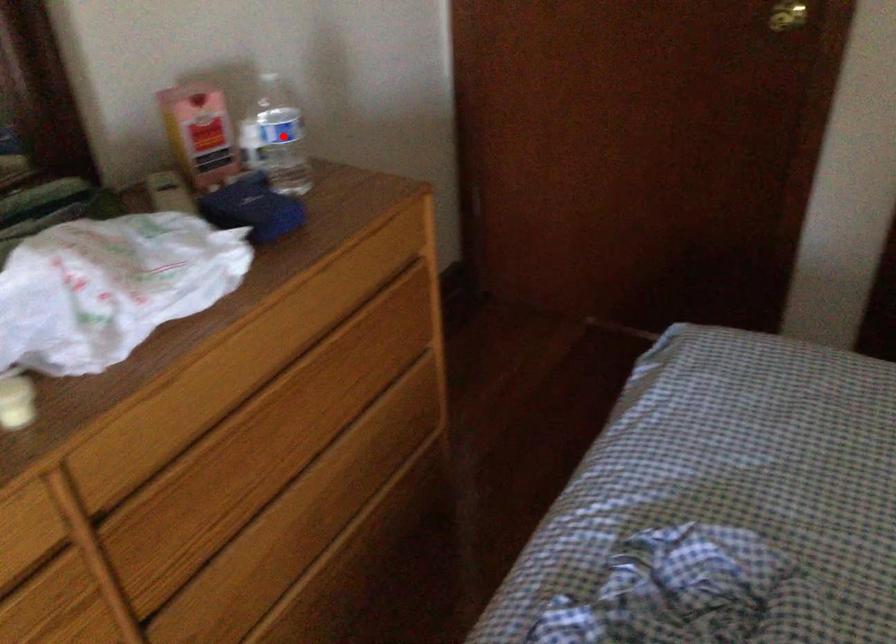
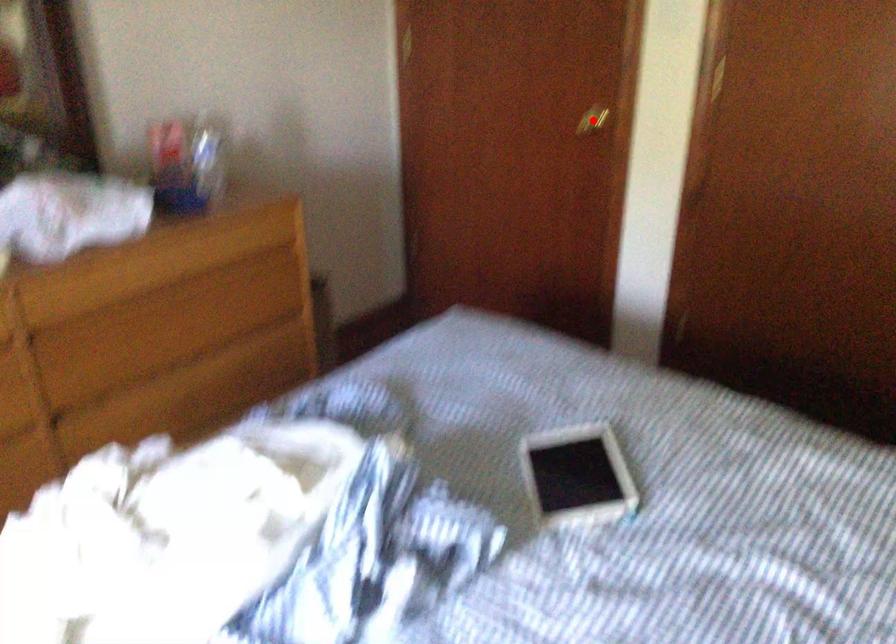
I am providing you with two images of the same scene from different viewpoints. A red point is marked on the first image and another point is marked on the second image. Does the point marked in image1 correspond to the same location as the one in image2?

No